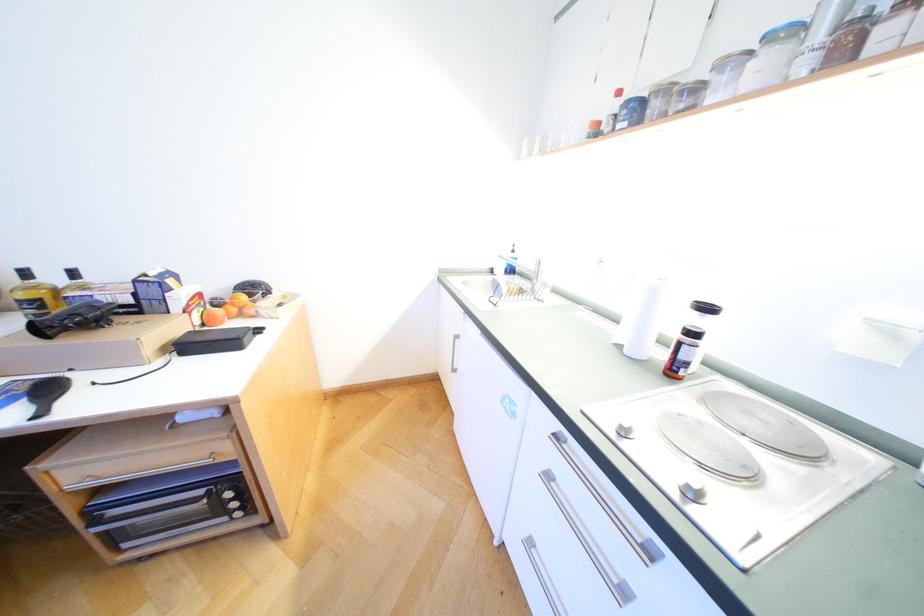
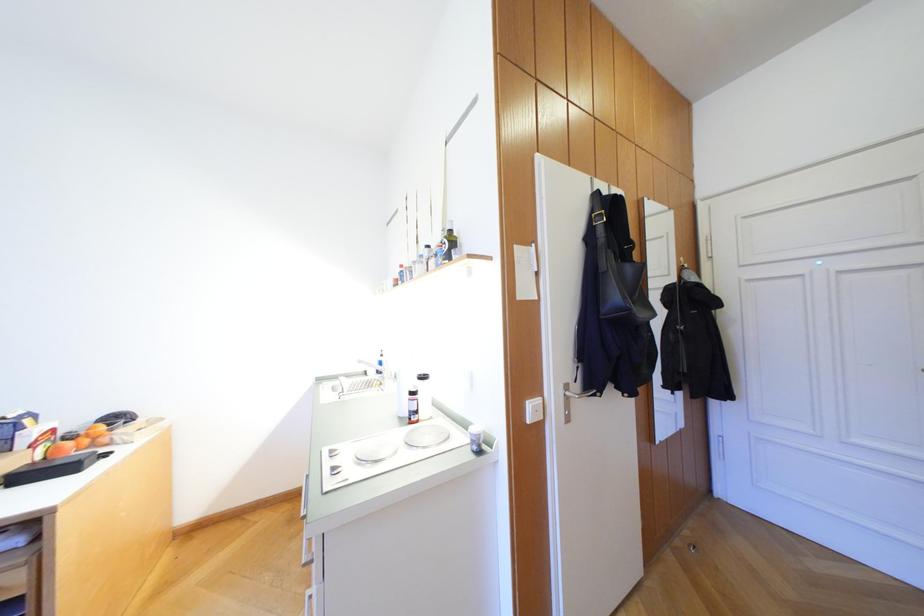
Which direction would the cameraman need to move to produce the second image?

The movement direction of the cameraman is right, backward.